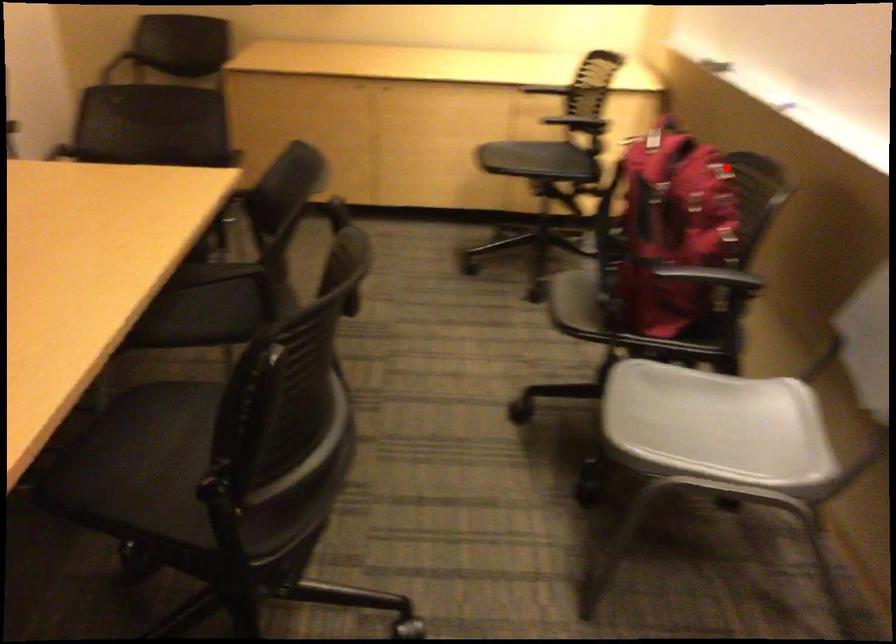
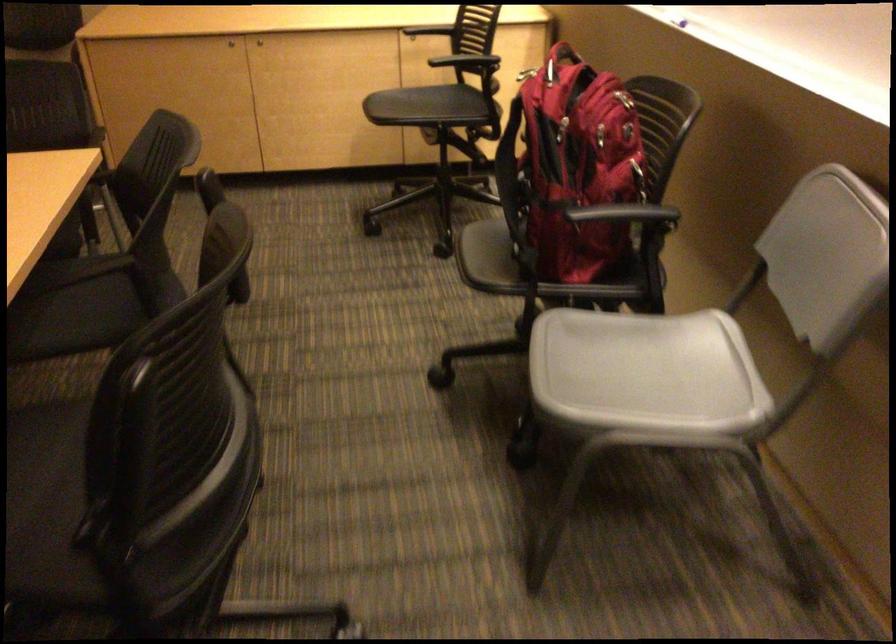
Find the pixel in the second image that matches the highlighted location in the first image.

(624, 98)